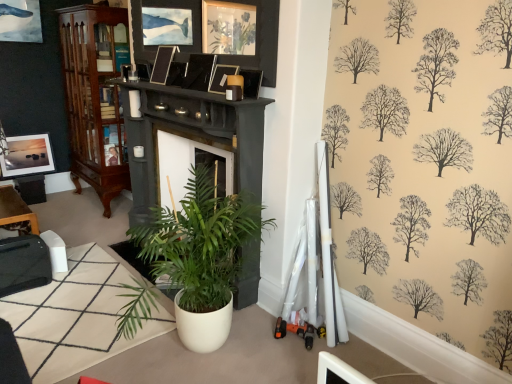
Question: Does satin black picture frame at upper center, the second picture frame when ordered from left to right, appear on the right side of white matte houseplant at center?

Choices:
 (A) yes
 (B) no

Answer: (B)

Question: Considering the relative sizes of satin black picture frame at upper center, which is the fourth picture frame in right-to-left order, and white matte houseplant at center in the image provided, is satin black picture frame at upper center, which is the fourth picture frame in right-to-left order, thinner than white matte houseplant at center?

Choices:
 (A) no
 (B) yes

Answer: (B)

Question: Is satin black picture frame at upper center, which is the fourth picture frame in right-to-left order, far away from white matte houseplant at center?

Choices:
 (A) yes
 (B) no

Answer: (A)

Question: From the image's perspective, would you say satin black picture frame at upper center, which is the fourth picture frame in right-to-left order, is positioned over white matte houseplant at center?

Choices:
 (A) yes
 (B) no

Answer: (A)

Question: From a real-world perspective, is satin black picture frame at upper center, which is the fourth picture frame in right-to-left order, over white matte houseplant at center?

Choices:
 (A) yes
 (B) no

Answer: (A)

Question: Could you tell me if satin black picture frame at upper center, the 2th picture frame when ordered from back to front, is turned towards white matte houseplant at center?

Choices:
 (A) yes
 (B) no

Answer: (B)

Question: Is black glossy picture frame at upper center, positioned as the second picture frame in front-to-back order, positioned with its back to white matte houseplant at center?

Choices:
 (A) no
 (B) yes

Answer: (A)

Question: Does black glossy picture frame at upper center, positioned as the second picture frame in front-to-back order, turn towards white matte houseplant at center?

Choices:
 (A) yes
 (B) no

Answer: (B)

Question: Does black glossy picture frame at upper center, the 2th picture frame viewed from the right, have a greater height compared to white matte houseplant at center?

Choices:
 (A) no
 (B) yes

Answer: (A)

Question: Does black glossy picture frame at upper center, positioned as the second picture frame in front-to-back order, appear on the left side of white matte houseplant at center?

Choices:
 (A) yes
 (B) no

Answer: (A)

Question: Is black glossy picture frame at upper center, which is counted as the 4th picture frame, starting from the back, in contact with white matte houseplant at center?

Choices:
 (A) no
 (B) yes

Answer: (A)

Question: Is black glossy picture frame at upper center, the 4th picture frame in the left-to-right sequence, bigger than white matte houseplant at center?

Choices:
 (A) no
 (B) yes

Answer: (A)

Question: Is black glossy picture frame at upper center, the 2th picture frame viewed from the right, facing towards matte black picture frame at upper center, placed as the third picture frame when sorted from right to left?

Choices:
 (A) yes
 (B) no

Answer: (B)